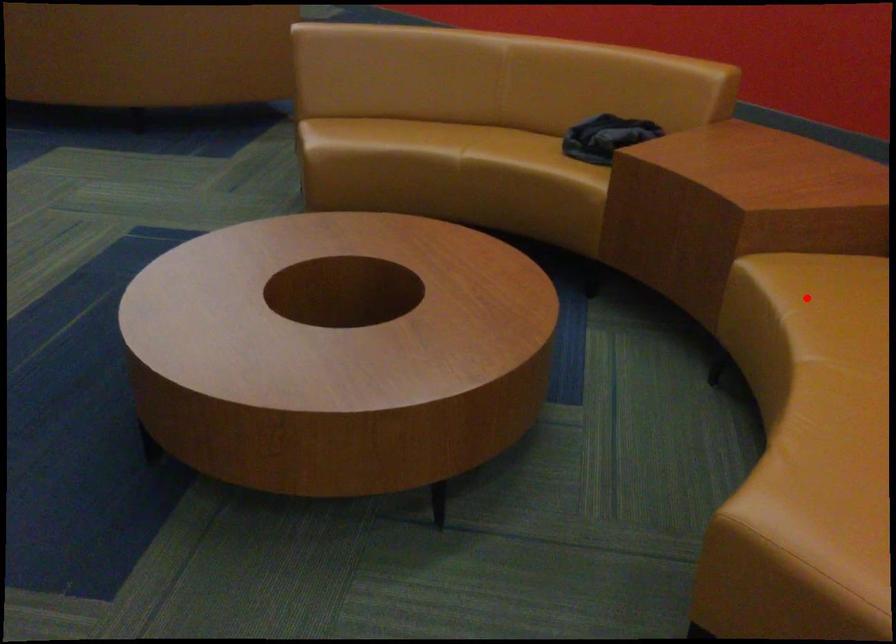
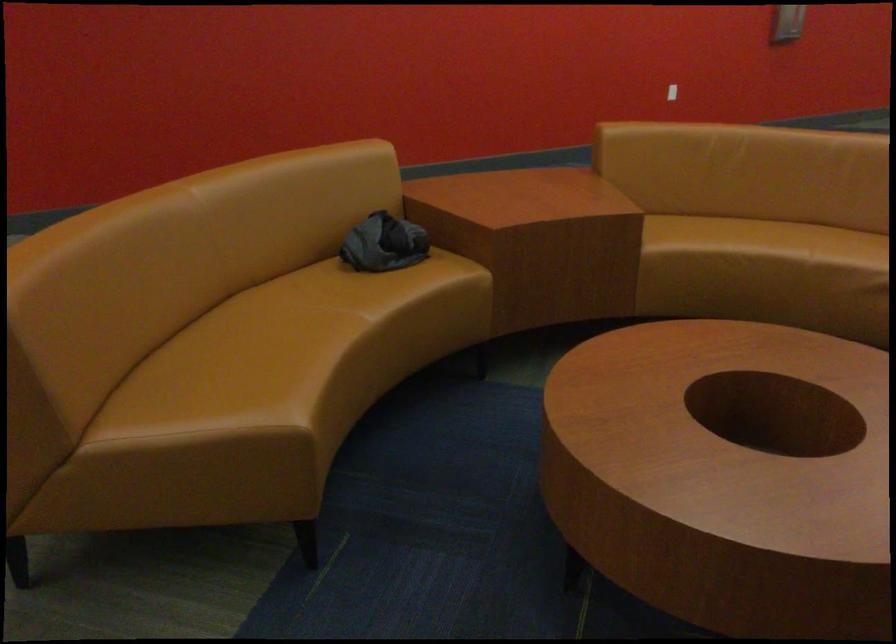
Question: I am providing you with two images of the same scene from different viewpoints. In image1, a red point is highlighted. Considering the same 3D point in image2, which of the following is correct?

Choices:
 (A) It is closer
 (B) It is farther

Answer: (B)